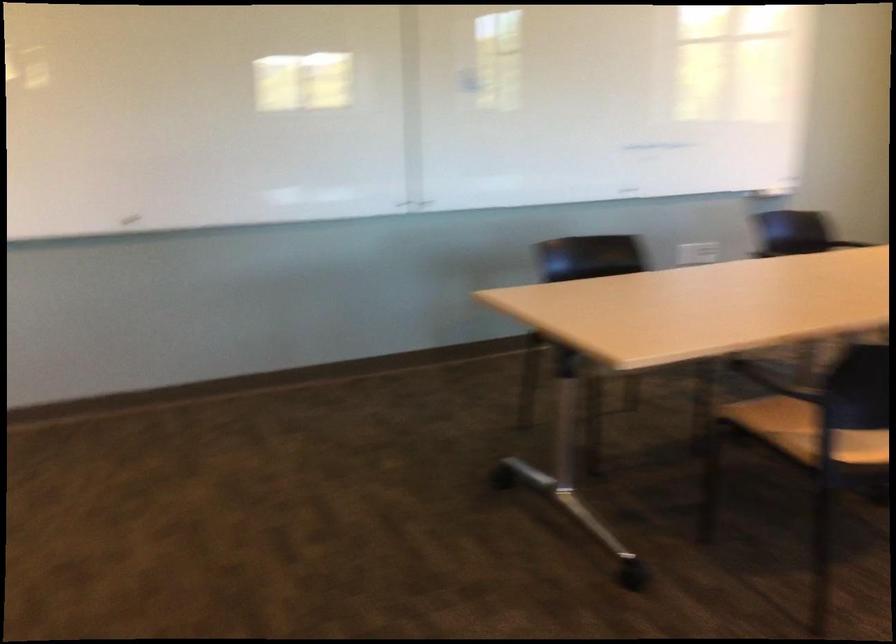
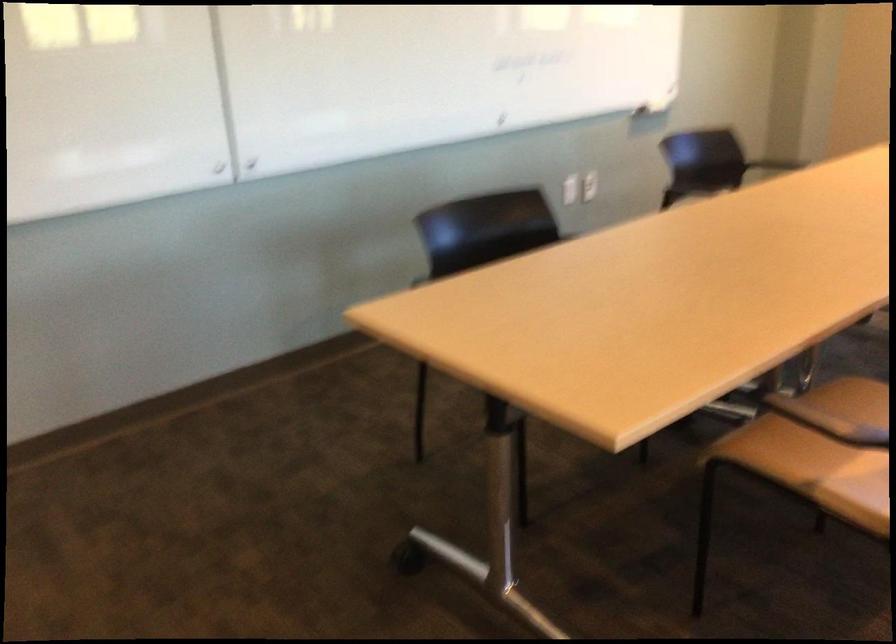
Where in the second image is the point corresponding to pixel 700 243 from the first image?

(589, 185)